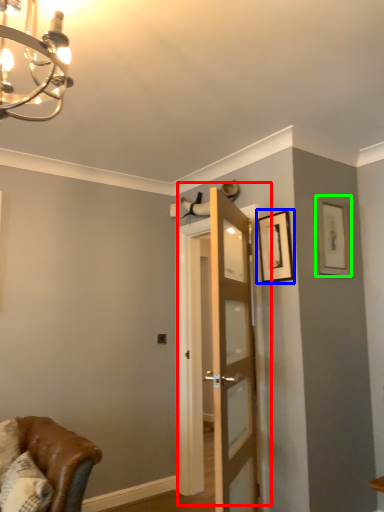
Question: Considering the real-world distances, which object is farthest from door (highlighted by a red box)? picture frame (highlighted by a blue box) or picture frame (highlighted by a green box)?

Choices:
 (A) picture frame
 (B) picture frame

Answer: (B)